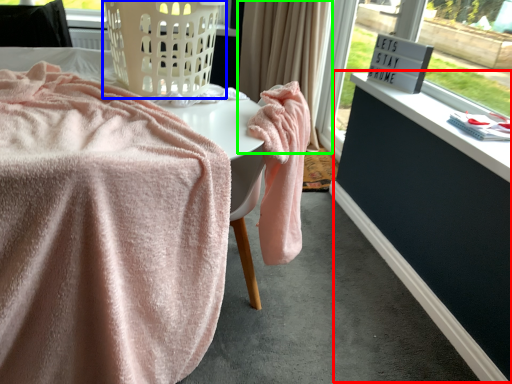
Question: Estimate the real-world distances between objects in this image. Which object is farther from dresser (highlighted by a red box), basket (highlighted by a blue box) or curtain (highlighted by a green box)?

Choices:
 (A) basket
 (B) curtain

Answer: (A)